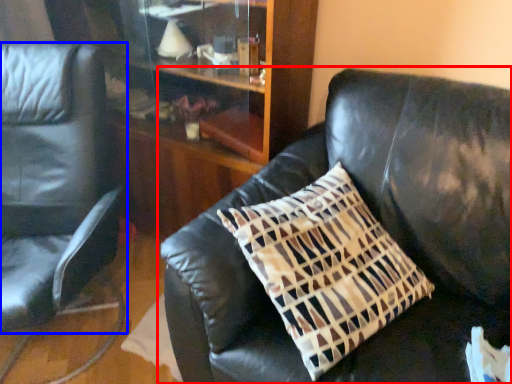
Question: Among these objects, which one is nearest to the camera, studio couch (highlighted by a red box) or chair (highlighted by a blue box)?

Choices:
 (A) studio couch
 (B) chair

Answer: (A)